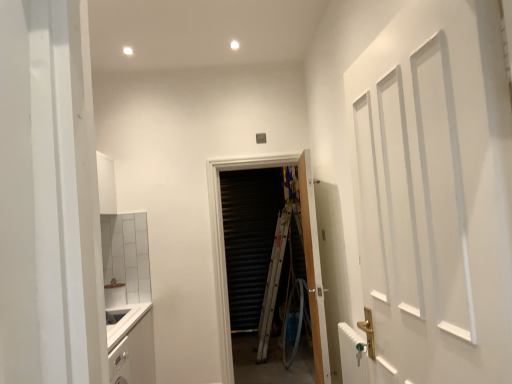
Question: From a real-world perspective, is white matte door at right, the 1th door from the front, on white matte cabinet at lower left?

Choices:
 (A) no
 (B) yes

Answer: (B)

Question: Does white matte door at right, the 1th door from the front, have a smaller size compared to white matte cabinet at lower left?

Choices:
 (A) no
 (B) yes

Answer: (B)

Question: Is white matte door at right, marked as the 3th door in a back-to-front arrangement, wider than white matte cabinet at lower left?

Choices:
 (A) no
 (B) yes

Answer: (A)

Question: From a real-world perspective, is white matte door at right, marked as the 3th door in a back-to-front arrangement, below white matte cabinet at lower left?

Choices:
 (A) yes
 (B) no

Answer: (B)

Question: Does white matte door at right, marked as the 3th door in a back-to-front arrangement, turn towards white matte cabinet at lower left?

Choices:
 (A) no
 (B) yes

Answer: (A)

Question: Is white matte cabinet at lower left located within white matte door at right, marked as the 3th door in a back-to-front arrangement?

Choices:
 (A) no
 (B) yes

Answer: (A)

Question: From a real-world perspective, is white metallic radiator at lower right on top of wooden door at center, the second door viewed from the front?

Choices:
 (A) yes
 (B) no

Answer: (B)

Question: From the image's perspective, does white metallic radiator at lower right appear lower than wooden door at center, the second door viewed from the front?

Choices:
 (A) yes
 (B) no

Answer: (A)

Question: Is white metallic radiator at lower right positioned behind wooden door at center, acting as the second door starting from the back?

Choices:
 (A) no
 (B) yes

Answer: (A)

Question: Is white metallic radiator at lower right bigger than wooden door at center, acting as the second door starting from the back?

Choices:
 (A) no
 (B) yes

Answer: (A)

Question: Is wooden door at center, the second door viewed from the front, completely or partially inside white metallic radiator at lower right?

Choices:
 (A) no
 (B) yes

Answer: (A)

Question: Is white metallic radiator at lower right oriented towards wooden door at center, the second door viewed from the front?

Choices:
 (A) yes
 (B) no

Answer: (B)

Question: Is white metallic radiator at lower right oriented towards wooden door at center, the third door in the front-to-back sequence?

Choices:
 (A) yes
 (B) no

Answer: (B)